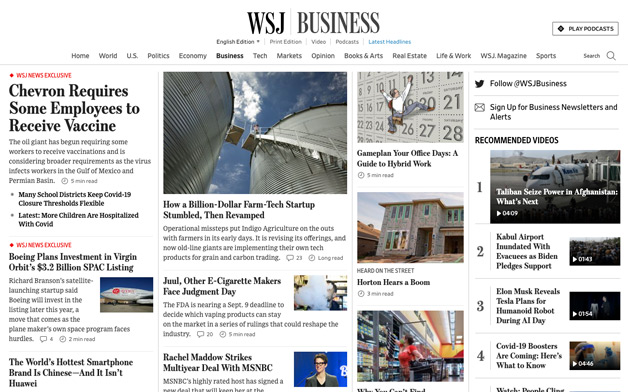
The width and height of the screenshot is (628, 392). I want to click on stairs, so click(291, 148).